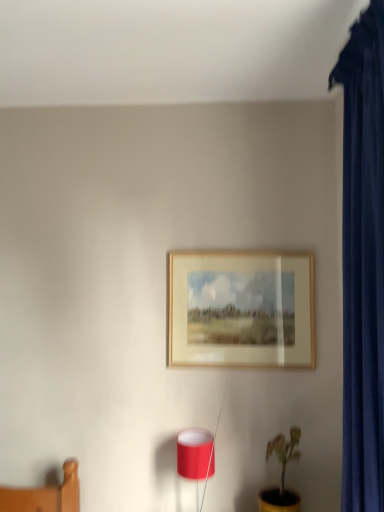
Question: Can we say matte red lampshade at lower center lies outside wooden frame at center?

Choices:
 (A) yes
 (B) no

Answer: (A)

Question: From a real-world perspective, is matte red lampshade at lower center over wooden frame at center?

Choices:
 (A) yes
 (B) no

Answer: (B)

Question: Can you confirm if matte red lampshade at lower center is positioned to the left of wooden frame at center?

Choices:
 (A) no
 (B) yes

Answer: (B)

Question: Does matte red lampshade at lower center have a smaller size compared to wooden frame at center?

Choices:
 (A) yes
 (B) no

Answer: (A)

Question: From a real-world perspective, does matte red lampshade at lower center sit lower than wooden frame at center?

Choices:
 (A) no
 (B) yes

Answer: (B)

Question: In terms of height, does matte red lampshade at lower center look taller or shorter compared to wooden frame at center?

Choices:
 (A) short
 (B) tall

Answer: (A)

Question: From the image's perspective, is matte red lampshade at lower center above or below wooden frame at center?

Choices:
 (A) below
 (B) above

Answer: (A)

Question: Is point (203, 479) closer or farther from the camera than point (264, 280)?

Choices:
 (A) farther
 (B) closer

Answer: (B)

Question: Considering the positions of matte red lampshade at lower center and wooden frame at center in the image, is matte red lampshade at lower center bigger or smaller than wooden frame at center?

Choices:
 (A) small
 (B) big

Answer: (A)

Question: Is point (296, 348) closer or farther from the camera than point (291, 503)?

Choices:
 (A) closer
 (B) farther

Answer: (B)

Question: Is wooden frame at center in front of or behind yellow matte pot at lower right in the image?

Choices:
 (A) behind
 (B) front

Answer: (A)

Question: From a real-world perspective, is wooden frame at center above or below yellow matte pot at lower right?

Choices:
 (A) above
 (B) below

Answer: (A)

Question: Is wooden frame at center taller or shorter than yellow matte pot at lower right?

Choices:
 (A) tall
 (B) short

Answer: (A)

Question: In the image, is wooden frame at center on the left side or the right side of matte red lampshade at lower center?

Choices:
 (A) right
 (B) left

Answer: (A)

Question: Is point (246, 265) positioned closer to the camera than point (196, 495)?

Choices:
 (A) farther
 (B) closer

Answer: (A)